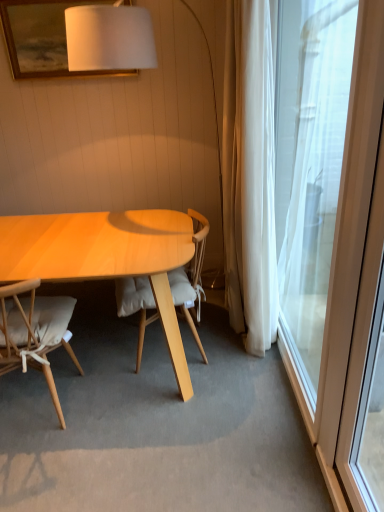
Question: Is transparent glass window at right positioned far away from light wood/wooden chair at center, the 2th chair in the left-to-right sequence?

Choices:
 (A) no
 (B) yes

Answer: (A)

Question: Is transparent glass window at right thinner than light wood/wooden chair at center, the 2th chair in the left-to-right sequence?

Choices:
 (A) no
 (B) yes

Answer: (B)

Question: Would you say transparent glass window at right is outside light wood/wooden chair at center, the 1th chair viewed from the right?

Choices:
 (A) yes
 (B) no

Answer: (A)

Question: Considering the relative sizes of transparent glass window at right and light wood/wooden chair at center, the 2th chair in the left-to-right sequence, in the image provided, is transparent glass window at right shorter than light wood/wooden chair at center, the 2th chair in the left-to-right sequence,?

Choices:
 (A) no
 (B) yes

Answer: (A)

Question: Does transparent glass window at right lie in front of light wood/wooden chair at center, the 2th chair in the left-to-right sequence?

Choices:
 (A) yes
 (B) no

Answer: (A)

Question: Does transparent glass window at right appear on the left side of light wood/wooden chair at center, the 2th chair in the left-to-right sequence?

Choices:
 (A) yes
 (B) no

Answer: (B)

Question: Considering the relative sizes of light wood/wooden chair at center, the 1th chair viewed from the right, and light brown wood chair at left, which ranks as the second chair in right-to-left order, in the image provided, is light wood/wooden chair at center, the 1th chair viewed from the right, smaller than light brown wood chair at left, which ranks as the second chair in right-to-left order,?

Choices:
 (A) no
 (B) yes

Answer: (A)

Question: Considering the relative positions of light wood/wooden chair at center, the 2th chair in the left-to-right sequence, and light brown wood chair at left, which ranks as the second chair in right-to-left order, in the image provided, is light wood/wooden chair at center, the 2th chair in the left-to-right sequence, to the right of light brown wood chair at left, which ranks as the second chair in right-to-left order, from the viewer's perspective?

Choices:
 (A) yes
 (B) no

Answer: (A)

Question: Considering the relative positions of light wood/wooden chair at center, the 1th chair viewed from the right, and light brown wood chair at left, acting as the first chair starting from the left, in the image provided, is light wood/wooden chair at center, the 1th chair viewed from the right, behind light brown wood chair at left, acting as the first chair starting from the left,?

Choices:
 (A) no
 (B) yes

Answer: (B)

Question: Considering the relative sizes of light wood/wooden chair at center, the 2th chair in the left-to-right sequence, and light brown wood chair at left, acting as the first chair starting from the left, in the image provided, is light wood/wooden chair at center, the 2th chair in the left-to-right sequence, thinner than light brown wood chair at left, acting as the first chair starting from the left,?

Choices:
 (A) yes
 (B) no

Answer: (A)

Question: From a real-world perspective, is light wood/wooden chair at center, the 2th chair in the left-to-right sequence, beneath light brown wood chair at left, acting as the first chair starting from the left?

Choices:
 (A) yes
 (B) no

Answer: (B)

Question: From a real-world perspective, is light wood/wooden chair at center, the 2th chair in the left-to-right sequence, located higher than light brown wood chair at left, which ranks as the second chair in right-to-left order?

Choices:
 (A) yes
 (B) no

Answer: (A)

Question: Can you confirm if transparent glass window at right is positioned to the right of light brown wood chair at left, acting as the first chair starting from the left?

Choices:
 (A) no
 (B) yes

Answer: (B)